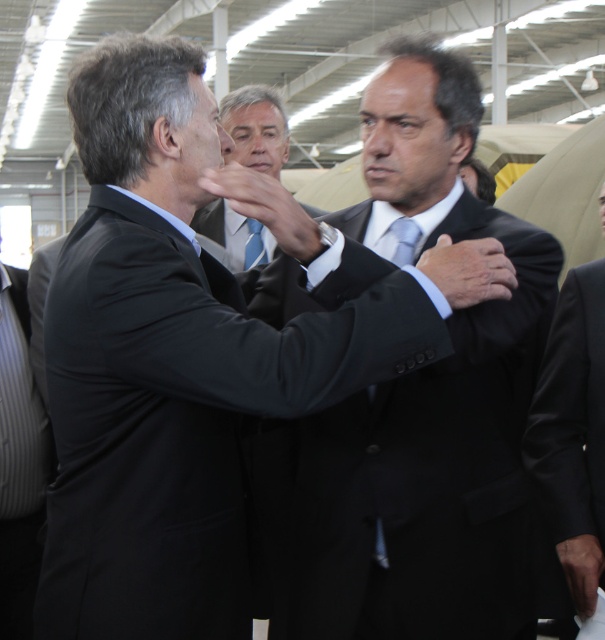
Question: Which point is farther to the camera?

Choices:
 (A) (482, 340)
 (B) (260, 257)
 (C) (581, 364)
 (D) (7, 355)

Answer: (B)

Question: Which of the following is the farthest from the observer?

Choices:
 (A) matte black suit at center
 (B) gray striped suit at left
 (C) silk tie at center

Answer: (A)

Question: Is silk tie at center to the right of blue striped tie at center from the viewer's perspective?

Choices:
 (A) no
 (B) yes

Answer: (B)

Question: Does black satin suit at center appear over matte black suit at center?

Choices:
 (A) no
 (B) yes

Answer: (A)

Question: Which point appears farthest from the camera in this image?

Choices:
 (A) (381, 420)
 (B) (594, 541)
 (C) (266, 260)

Answer: (C)

Question: Does black satin suit at right appear on the left side of gray striped suit at left?

Choices:
 (A) no
 (B) yes

Answer: (A)